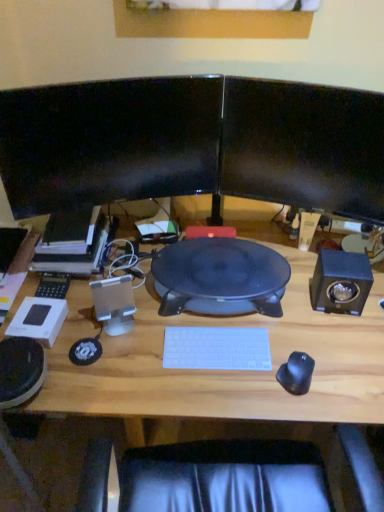
Locate an element on the screen. The height and width of the screenshot is (512, 384). free space below white plastic keyboard at center (from a real-world perspective) is located at coordinates (215, 351).